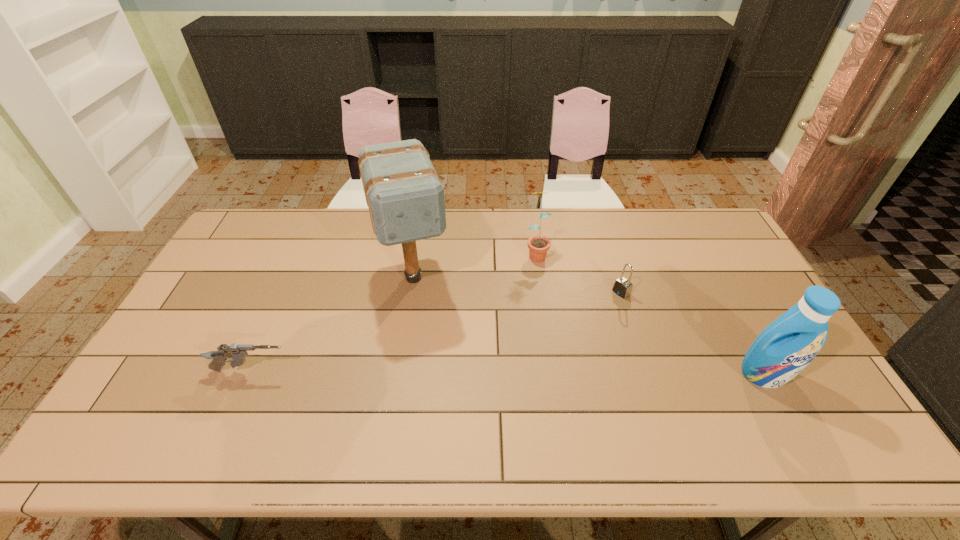
In order to click on vacant spot on the desktop that is between the gun and the detergent and is positioned on the shackle of the padlock in this screenshot , I will do `click(498, 373)`.

I want to click on vacant spot on the desktop that is between the gun and the rightmost object and is positioned on the flower of the third tallest object, so click(x=572, y=373).

What are the coordinates of `vacant spot on the desktop that is between the gun and the second tallest object and is positioned on the striking surface of the tallest object` in the screenshot? It's located at (444, 372).